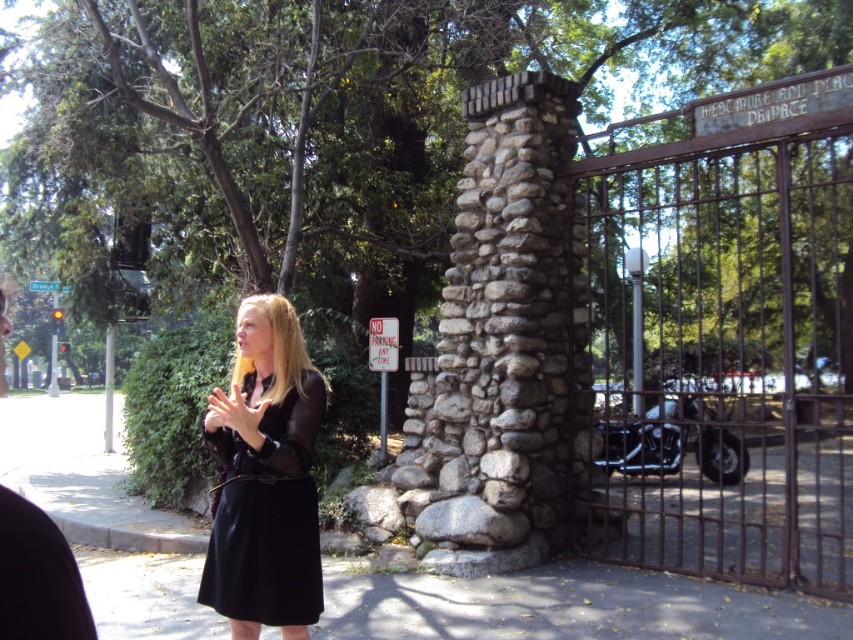
Question: Which object is positioned closest to the blonde hair at center?

Choices:
 (A) gray concrete pavement at lower center
 (B) black leather coat at center

Answer: (B)

Question: Can you confirm if gray concrete pavement at lower center is wider than smooth skin hands at center?

Choices:
 (A) yes
 (B) no

Answer: (A)

Question: Is gray concrete pavement at lower center closer to camera compared to smooth skin hands at center?

Choices:
 (A) yes
 (B) no

Answer: (B)

Question: Which is farther from the black leather coat at center?

Choices:
 (A) gray concrete pavement at lower center
 (B) smooth skin hands at center

Answer: (A)

Question: Which of the following is the farthest from the observer?

Choices:
 (A) blonde hair at center
 (B) gray concrete pavement at lower center

Answer: (B)

Question: Does gray concrete pavement at lower center lie in front of smooth skin hands at center?

Choices:
 (A) yes
 (B) no

Answer: (B)